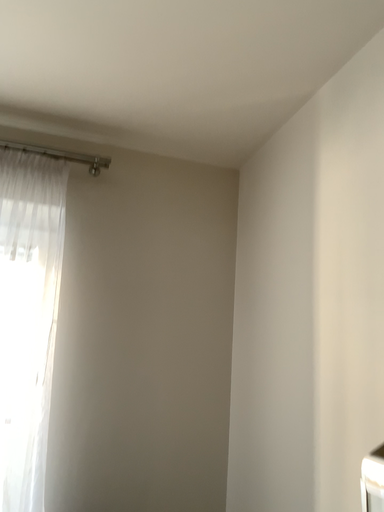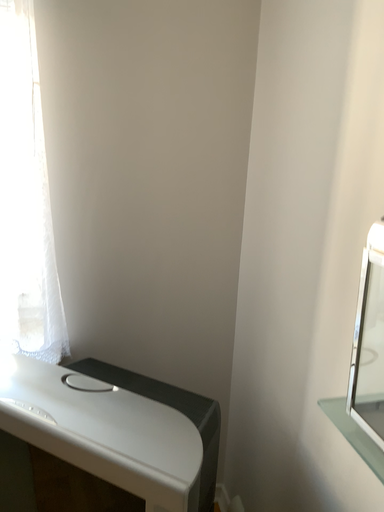
Question: Which way did the camera rotate in the video?

Choices:
 (A) rotated upward
 (B) rotated downward

Answer: (B)